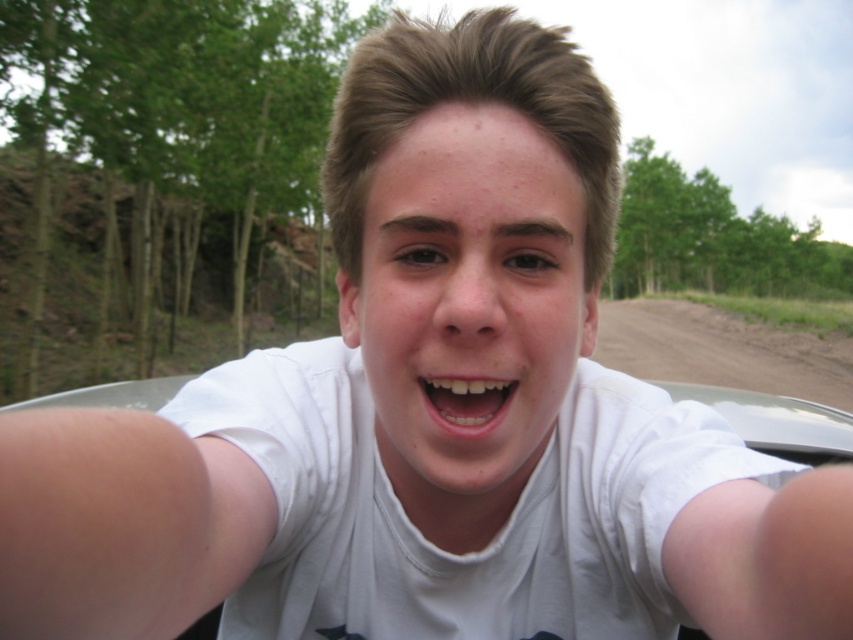
You are a photographer trying to capture the best angle of the selfie. Since the brown dirt track at lower right and the white glossy teeth at center are both in the frame, which object would you adjust your camera to focus on first if you want to ensure the subject is sharp?

The brown dirt track at lower right is positioned over white glossy teeth at center, so focusing on the white glossy teeth at center first would ensure the subject is sharp as they are closer to the camera.